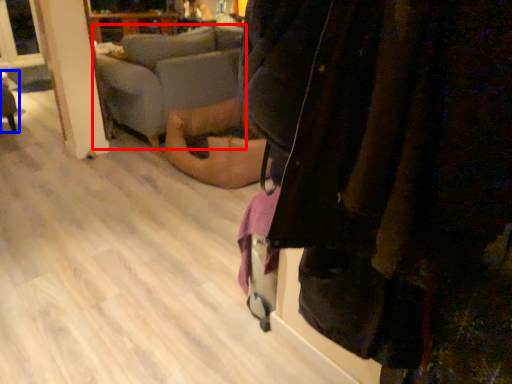
Question: Which object appears farthest to the camera in this image, studio couch (highlighted by a red box) or furniture (highlighted by a blue box)?

Choices:
 (A) studio couch
 (B) furniture

Answer: (B)